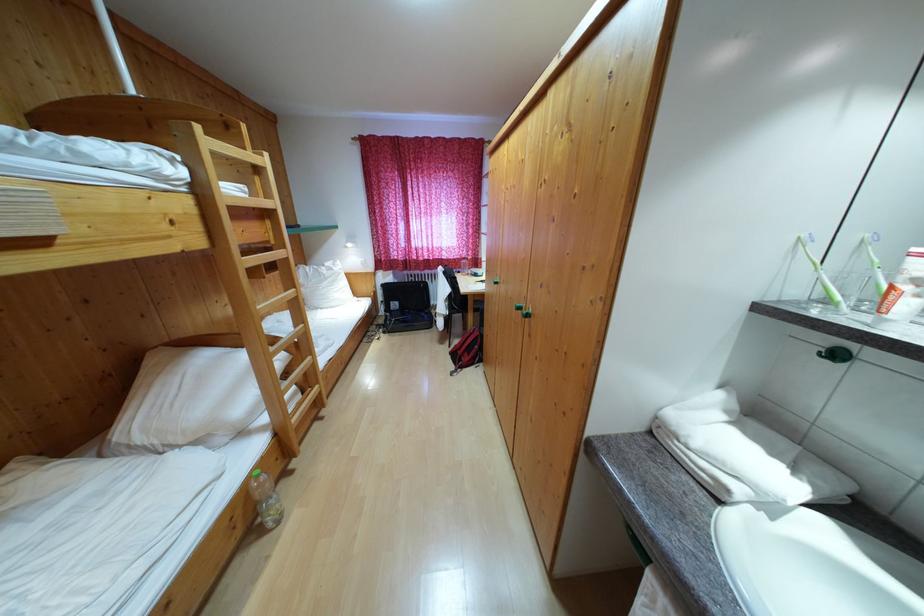
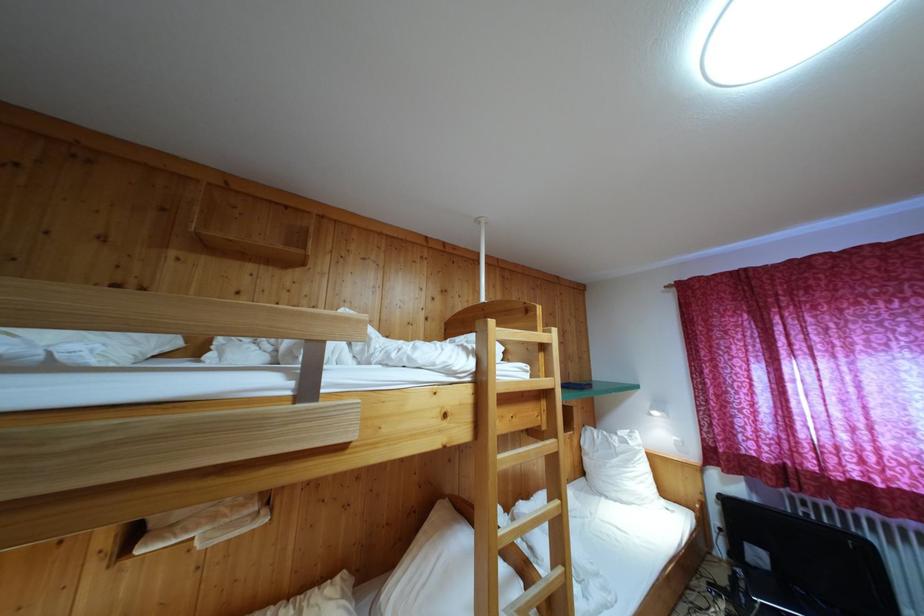
Looking at this image, first-person continuous shooting, in which direction is the camera rotating?

The camera's rotation is toward left-up.